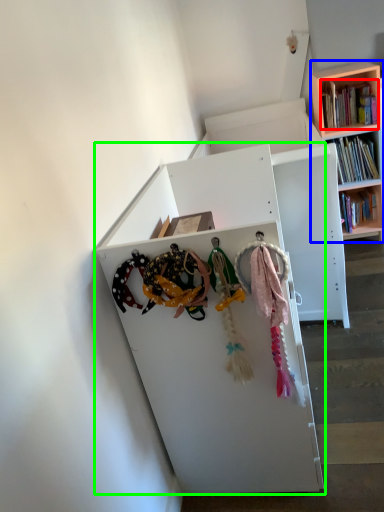
Question: Considering the real-world distances, which object is closest to book (highlighted by a red box)? bookcase (highlighted by a blue box) or shelf (highlighted by a green box).

Choices:
 (A) bookcase
 (B) shelf

Answer: (A)